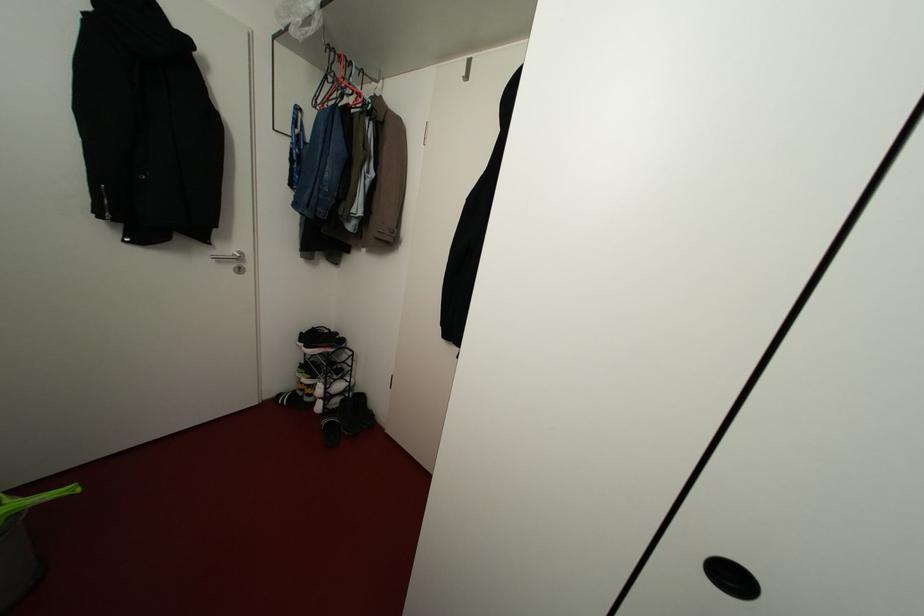
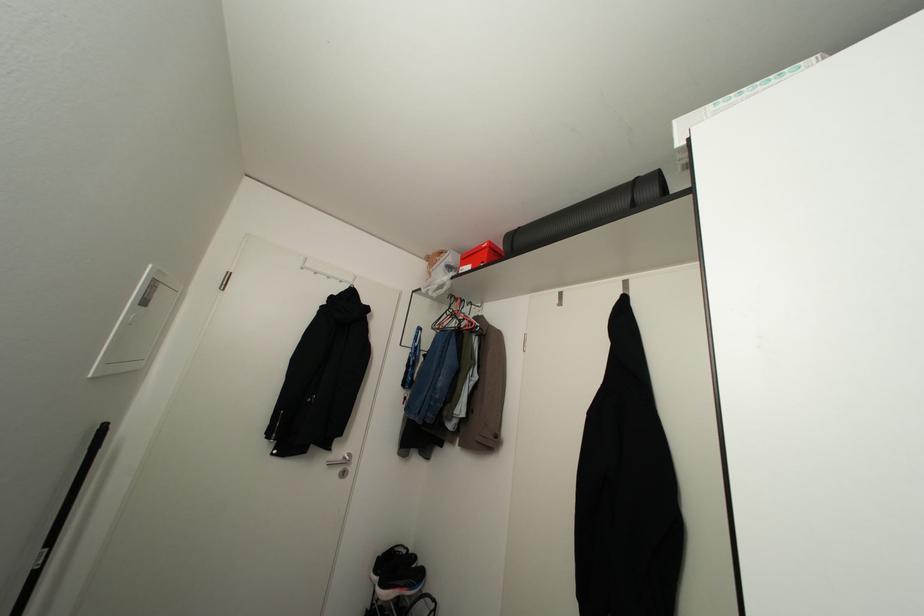
First-person continuous shooting, in which direction is the camera rotating?

The camera rotated toward left-up.